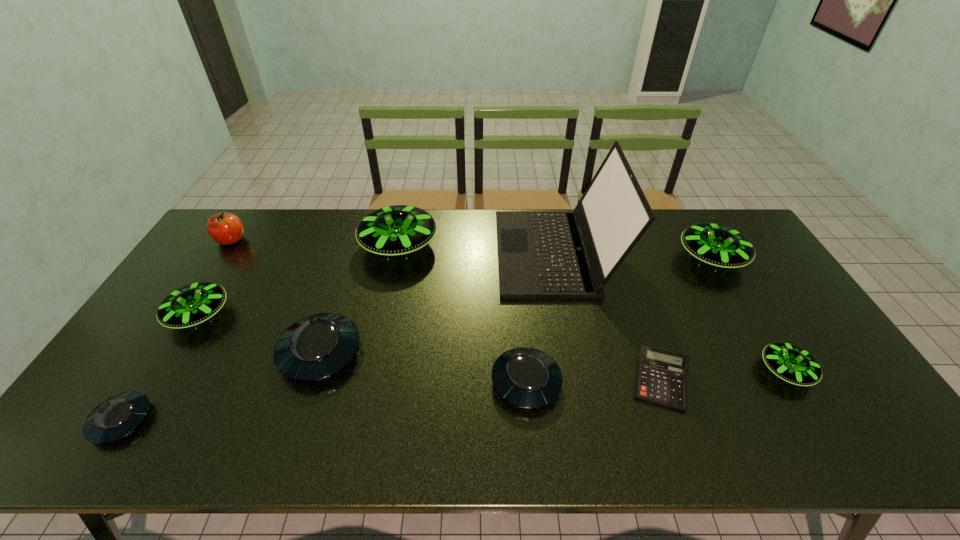
The width and height of the screenshot is (960, 540). I want to click on blank area located on the right of the apple, so (x=276, y=240).

Where is `free location located 0.080m on the front of the leftmost green saucer`? This screenshot has width=960, height=540. free location located 0.080m on the front of the leftmost green saucer is located at coordinates (169, 363).

Identify the location of vacant space located on the front of the second gray saucer from right to left. (288, 450).

Where is `vacant region located on the left of the nearest green saucer`? This screenshot has height=540, width=960. vacant region located on the left of the nearest green saucer is located at coordinates (686, 371).

You are a GUI agent. You are given a task and a screenshot of the screen. Output one action in this format:
    pyautogui.click(x=<x>, y=<y>)
    Task: Click on the vacant region located 0.270m on the right of the second biggest gray saucer
    
    Given the screenshot: What is the action you would take?
    pyautogui.click(x=667, y=382)

This screenshot has height=540, width=960. Identify the location of vacant space situated 0.120m on the back of the shortest saucer. (162, 357).

Locate an element on the screen. vacant space situated on the back of the calculator is located at coordinates (620, 266).

The image size is (960, 540). In order to click on laptop present at the far edge in this screenshot , I will do `click(541, 254)`.

Where is `apple that is at the far edge`? apple that is at the far edge is located at coordinates (224, 228).

Locate an element on the screen. object present at the near edge is located at coordinates (115, 418).